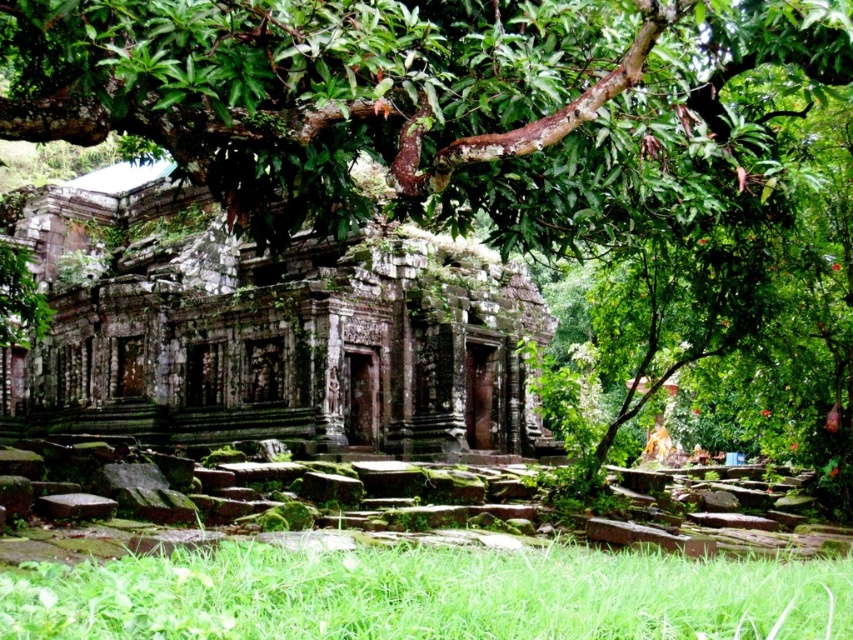
Question: Which point is closer to the camera taking this photo?

Choices:
 (A) (18, 403)
 (B) (590, 612)
 (C) (384, 140)

Answer: (B)

Question: Which object is the farthest from the green mossy stone temple at center?

Choices:
 (A) green grass at lower center
 (B) green leafy tree at upper center

Answer: (A)

Question: Can you confirm if green leafy tree at upper center is thinner than green mossy stone temple at center?

Choices:
 (A) no
 (B) yes

Answer: (B)

Question: Does green mossy stone temple at center appear on the left side of green grass at lower center?

Choices:
 (A) no
 (B) yes

Answer: (B)

Question: Is the position of green leafy tree at upper center less distant than that of green grass at lower center?

Choices:
 (A) yes
 (B) no

Answer: (B)

Question: Which of the following is the farthest from the observer?

Choices:
 (A) green leafy tree at upper center
 (B) green mossy stone temple at center

Answer: (B)